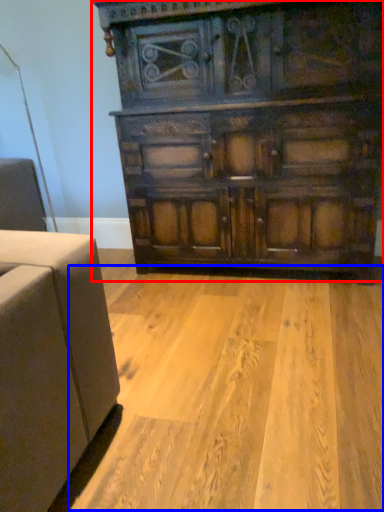
Question: Among these objects, which one is farthest to the camera, chest of drawers (highlighted by a red box) or plywood (highlighted by a blue box)?

Choices:
 (A) chest of drawers
 (B) plywood

Answer: (A)